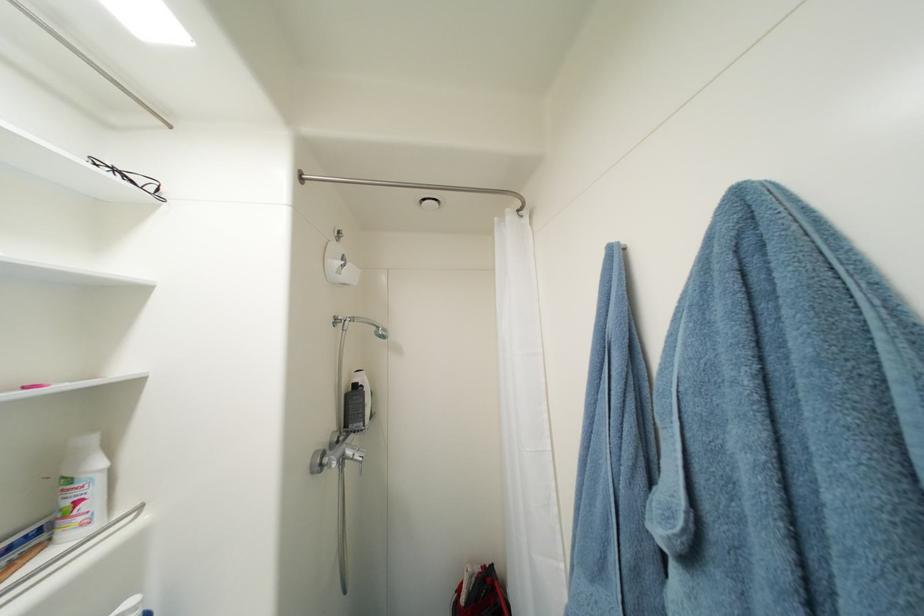
I want to click on red and black bag, so click(480, 593).